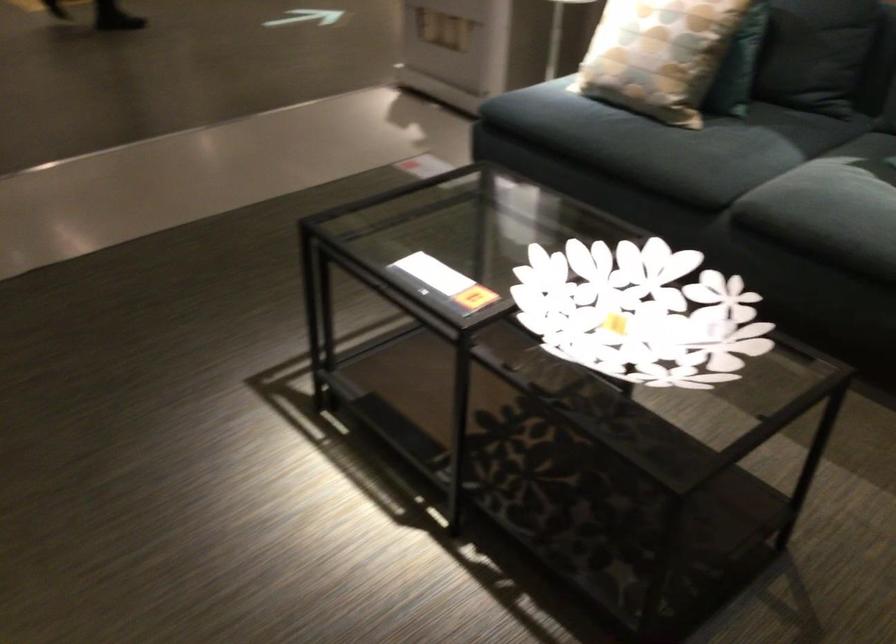
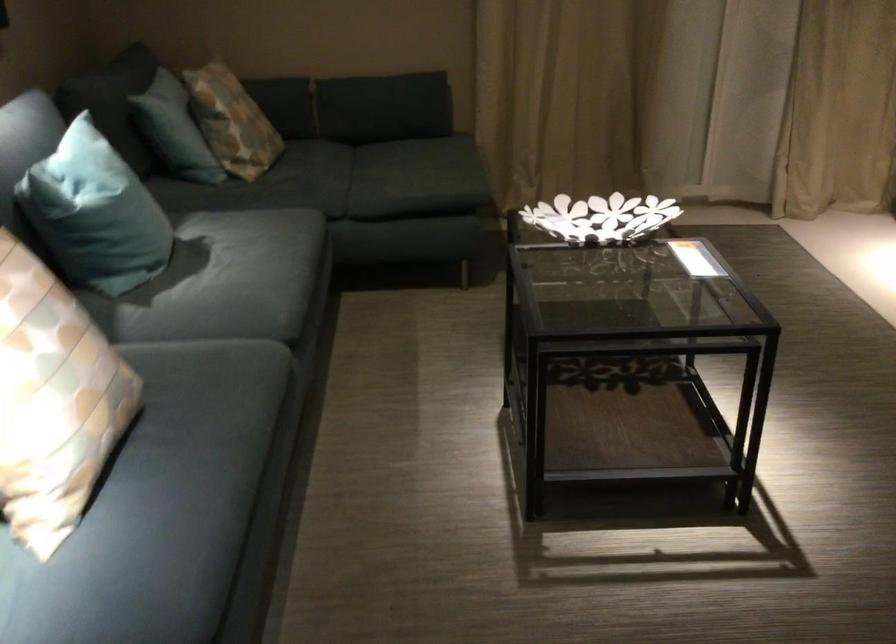
Locate, in the second image, the point that corresponds to point 615,126 in the first image.

(197, 436)